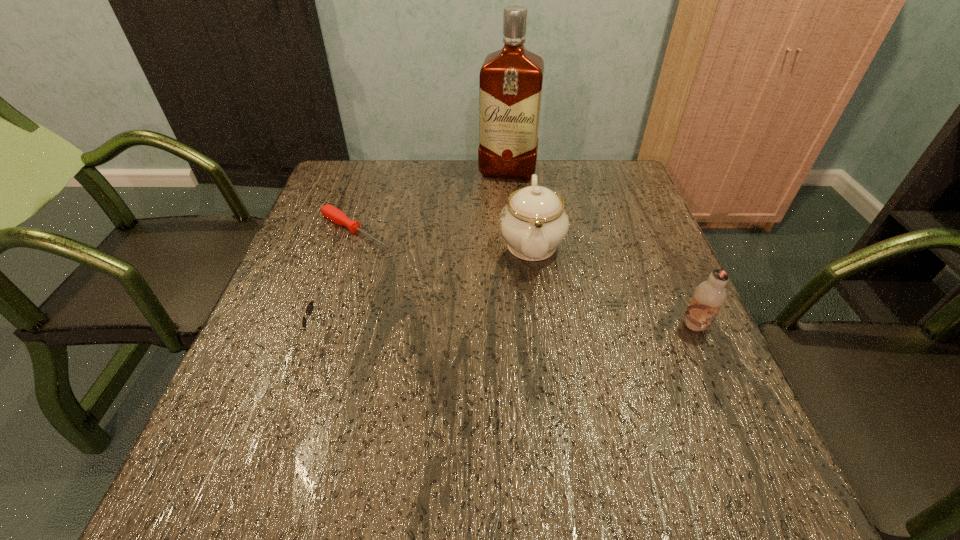
You are a GUI agent. You are given a task and a screenshot of the screen. Output one action in this format:
    pyautogui.click(x=<x>, y=<y>)
    Task: Click on the object located in the right edge section of the desktop
    
    Given the screenshot: What is the action you would take?
    pyautogui.click(x=709, y=296)

This screenshot has width=960, height=540. I want to click on vacant position at the far edge of the desktop, so click(x=488, y=197).

This screenshot has height=540, width=960. I want to click on free space at the near edge of the desktop, so click(x=606, y=403).

This screenshot has width=960, height=540. Find the location of `blank space at the left edge of the desktop`. blank space at the left edge of the desktop is located at coordinates (296, 266).

Find the location of `vacant region at the right edge`. vacant region at the right edge is located at coordinates pyautogui.click(x=662, y=248).

The height and width of the screenshot is (540, 960). I want to click on vacant space at the far left corner, so click(x=354, y=163).

Where is `vacant space at the near left corner of the desktop`? The width and height of the screenshot is (960, 540). vacant space at the near left corner of the desktop is located at coordinates (283, 417).

Locate an element on the screen. The width and height of the screenshot is (960, 540). vacant space at the far right corner of the desktop is located at coordinates point(598,166).

Image resolution: width=960 pixels, height=540 pixels. I want to click on blank space at the near right corner, so coord(756,439).

At what (x,y) coordinates should I click in order to perform the action: click on vacant area that lies between the screwdriver and the tallest object. Please return your answer as a coordinate pair (x, y). The height and width of the screenshot is (540, 960). Looking at the image, I should click on (432, 201).